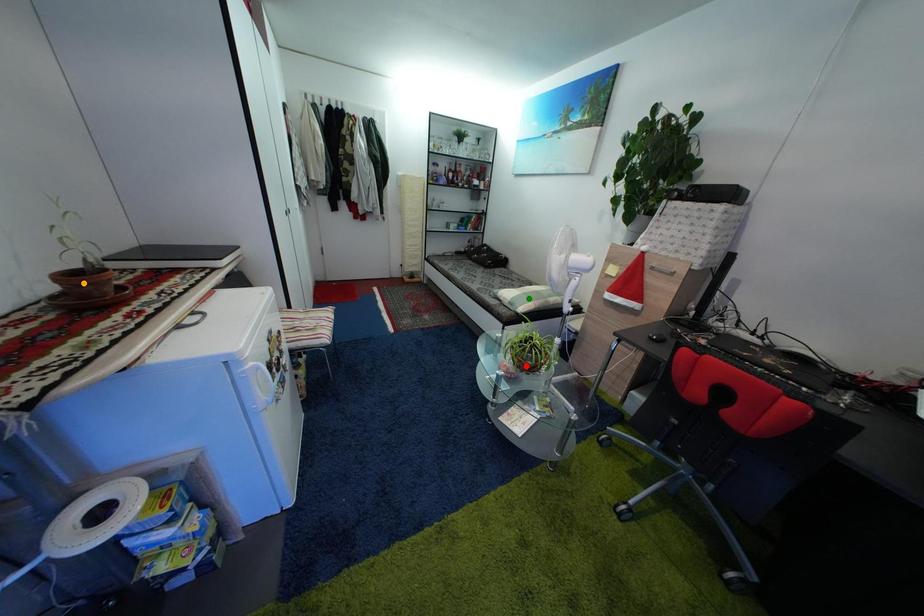
Order these from nearest to farthest:
- orange point
- green point
- red point

orange point < red point < green point